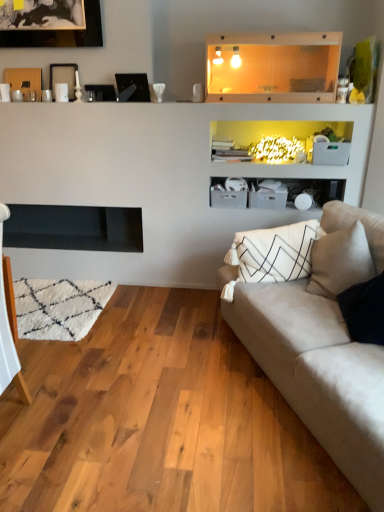
The width and height of the screenshot is (384, 512). Identify the location of transparent glass shelf at upper center. (273, 68).

What do you see at coordinates (74, 228) in the screenshot? I see `black matte fireplace at left` at bounding box center [74, 228].

This screenshot has height=512, width=384. Describe the element at coordinates (102, 92) in the screenshot. I see `matte black picture frame at upper center, which is the 3th picture frame from left to right` at that location.

The width and height of the screenshot is (384, 512). What do you see at coordinates (50, 23) in the screenshot? I see `black matte picture frame at upper left, which is the 1th picture frame in left-to-right order` at bounding box center [50, 23].

What do you see at coordinates (135, 84) in the screenshot? The width and height of the screenshot is (384, 512). I see `black glass picture frame at upper center, marked as the 4th picture frame in a left-to-right arrangement` at bounding box center [135, 84].

Identify the location of transparent glass shelf at upper center. (273, 68).

Locate an element on the screen. the 2nd picture frame above the black glass picture frame at upper center, marked as the 4th picture frame in a left-to-right arrangement (from a real-world perspective) is located at coordinates (50, 23).

Is black matte picture frame at upper left, which is the 1th picture frame in left-to-right order, oriented away from black glass picture frame at upper center, marked as the 4th picture frame in a left-to-right arrangement?

black matte picture frame at upper left, which is the 1th picture frame in left-to-right order, is not turned away from black glass picture frame at upper center, marked as the 4th picture frame in a left-to-right arrangement.

From the image's perspective, is black matte picture frame at upper left, which is the 1th picture frame in left-to-right order, over black glass picture frame at upper center, the 1th picture frame when ordered from right to left?

Yes, from the image's perspective, black matte picture frame at upper left, which is the 1th picture frame in left-to-right order, is on top of black glass picture frame at upper center, the 1th picture frame when ordered from right to left.

From a real-world perspective, which object rests below the other?

black matte fireplace at left, from a real-world perspective.

From a real-world perspective, starting from the black matte fireplace at left, which picture frame is the 4th one vertically above it? Please provide its 2D coordinates.

[(50, 23)]

Is black matte fireplace at left far from black matte picture frame at upper left, the 4th picture frame from the right?

Yes, black matte fireplace at left and black matte picture frame at upper left, the 4th picture frame from the right, are located far from each other.

Is black matte fireplace at left facing towards suede beige couch at right?

No.

From the picture: Which object is closer to the camera, black matte fireplace at left or suede beige couch at right?

suede beige couch at right is in front.

Measure the distance between black matte fireplace at left and suede beige couch at right.

black matte fireplace at left and suede beige couch at right are 1.53 meters apart from each other.

Is black matte fireplace at left with suede beige couch at right?

black matte fireplace at left and suede beige couch at right are clearly separated.

Consider the image. How distant is black glass picture frame at upper center, the 1th picture frame when ordered from right to left, from wooden picture frame at upper left, arranged as the second picture frame when viewed from the left?

The distance of black glass picture frame at upper center, the 1th picture frame when ordered from right to left, from wooden picture frame at upper left, arranged as the second picture frame when viewed from the left, is 17.76 inches.

Consider the image. Could wooden picture frame at upper left, arranged as the second picture frame when viewed from the left, be considered to be inside black glass picture frame at upper center, the 1th picture frame when ordered from right to left?

No, wooden picture frame at upper left, arranged as the second picture frame when viewed from the left, is located outside of black glass picture frame at upper center, the 1th picture frame when ordered from right to left.

Considering the relative positions of black glass picture frame at upper center, the 1th picture frame when ordered from right to left, and wooden picture frame at upper left, the third picture frame from the right, in the image provided, is black glass picture frame at upper center, the 1th picture frame when ordered from right to left, to the left or to the right of wooden picture frame at upper left, the third picture frame from the right,?

From the image, it's evident that black glass picture frame at upper center, the 1th picture frame when ordered from right to left, is to the right of wooden picture frame at upper left, the third picture frame from the right.

From a real-world perspective, count 1st picture frames downward from the wooden picture frame at upper left, arranged as the second picture frame when viewed from the left, and point to it. Please provide its 2D coordinates.

[(135, 84)]

Where is `studio couch lying below the black matte picture frame at upper left, the 4th picture frame from the right (from the image's perspective)`? This screenshot has width=384, height=512. studio couch lying below the black matte picture frame at upper left, the 4th picture frame from the right (from the image's perspective) is located at coordinates (318, 338).

From the image's perspective, is black matte picture frame at upper left, which is the 1th picture frame in left-to-right order, under suede beige couch at right?

Incorrect, from the image's perspective, black matte picture frame at upper left, which is the 1th picture frame in left-to-right order, is higher than suede beige couch at right.

Is black matte picture frame at upper left, which is the 1th picture frame in left-to-right order, positioned with its back to suede beige couch at right?

No, suede beige couch at right is not at the back of black matte picture frame at upper left, which is the 1th picture frame in left-to-right order.

Considering the points (98, 36) and (311, 254), which point is in front, point (98, 36) or point (311, 254)?

Point (311, 254)

From the image's perspective, is suede beige couch at right under matte black picture frame at upper center, which is the 3th picture frame from left to right?

Yes, from the image's perspective, suede beige couch at right is beneath matte black picture frame at upper center, which is the 3th picture frame from left to right.

From the picture: From a real-world perspective, is suede beige couch at right physically above matte black picture frame at upper center, which is the 3th picture frame from left to right?

No, from a real-world perspective, suede beige couch at right is not above matte black picture frame at upper center, which is the 3th picture frame from left to right.

Is matte black picture frame at upper center, the second picture frame positioned from the right, at the back of suede beige couch at right?

No, suede beige couch at right's orientation is not away from matte black picture frame at upper center, the second picture frame positioned from the right.

In the image, is suede beige couch at right positioned in front of or behind matte black picture frame at upper center, the second picture frame positioned from the right?

Clearly, suede beige couch at right is in front of matte black picture frame at upper center, the second picture frame positioned from the right.

Where is `fireplace located above the suede beige couch at right (from the image's perspective)`? fireplace located above the suede beige couch at right (from the image's perspective) is located at coordinates (74, 228).

Between suede beige couch at right and black matte fireplace at left, which one appears on the left side from the viewer's perspective?

black matte fireplace at left.

Based on the photo, can you confirm if suede beige couch at right is thinner than black matte fireplace at left?

No.

Does suede beige couch at right lie in front of black matte fireplace at left?

Yes, the depth of suede beige couch at right is less than that of black matte fireplace at left.

You are a GUI agent. You are given a task and a screenshot of the screen. Output one action in this format:
    pyautogui.click(x=<x>, y=<y>)
    Task: Click on the 3rd picture frame below when counting from the black matte picture frame at upper left, the 4th picture frame from the right (from the image's perspective)
    The image size is (384, 512).
    Given the screenshot: What is the action you would take?
    pos(135,84)

Where is `picture frame that is the 4th one above the black matte fireplace at left (from a real-world perspective)`? picture frame that is the 4th one above the black matte fireplace at left (from a real-world perspective) is located at coordinates (50, 23).

Considering their positions, is black matte fireplace at left positioned closer to matte black picture frame at upper center, which is the 3th picture frame from left to right, than black matte picture frame at upper left, the 4th picture frame from the right?

Based on the image, black matte picture frame at upper left, the 4th picture frame from the right, appears to be nearer to matte black picture frame at upper center, which is the 3th picture frame from left to right.

Based on their spatial positions, is wooden picture frame at upper left, the third picture frame from the right, or matte black picture frame at upper center, the second picture frame positioned from the right, further from black matte picture frame at upper left, which is the 1th picture frame in left-to-right order?

matte black picture frame at upper center, the second picture frame positioned from the right, lies further to black matte picture frame at upper left, which is the 1th picture frame in left-to-right order, than the other object.

Based on their spatial positions, is black glass picture frame at upper center, marked as the 4th picture frame in a left-to-right arrangement, or transparent glass shelf at upper center closer to matte black picture frame at upper center, which is the 3th picture frame from left to right?

The object closer to matte black picture frame at upper center, which is the 3th picture frame from left to right, is black glass picture frame at upper center, marked as the 4th picture frame in a left-to-right arrangement.

Estimate the real-world distances between objects in this image. Which object is further from black glass picture frame at upper center, the 1th picture frame when ordered from right to left, black matte fireplace at left or matte black picture frame at upper center, the second picture frame positioned from the right?

black matte fireplace at left is further to black glass picture frame at upper center, the 1th picture frame when ordered from right to left.

Estimate the real-world distances between objects in this image. Which object is further from matte black picture frame at upper center, the second picture frame positioned from the right, black matte picture frame at upper left, the 4th picture frame from the right, or black glass picture frame at upper center, marked as the 4th picture frame in a left-to-right arrangement?

Among the two, black matte picture frame at upper left, the 4th picture frame from the right, is located further to matte black picture frame at upper center, the second picture frame positioned from the right.

Estimate the real-world distances between objects in this image. Which object is closer to black glass picture frame at upper center, the 1th picture frame when ordered from right to left, suede beige couch at right or black matte fireplace at left?

Based on the image, black matte fireplace at left appears to be nearer to black glass picture frame at upper center, the 1th picture frame when ordered from right to left.

Considering their positions, is black glass picture frame at upper center, the 1th picture frame when ordered from right to left, positioned further to suede beige couch at right than black matte fireplace at left?

black glass picture frame at upper center, the 1th picture frame when ordered from right to left, is positioned further to the anchor suede beige couch at right.

In the scene shown: From the image, which object appears to be farther from black glass picture frame at upper center, the 1th picture frame when ordered from right to left, transparent glass shelf at upper center or suede beige couch at right?

suede beige couch at right lies further to black glass picture frame at upper center, the 1th picture frame when ordered from right to left, than the other object.

Where is `shelf positioned between suede beige couch at right and matte black picture frame at upper center, which is the 3th picture frame from left to right, from near to far`? shelf positioned between suede beige couch at right and matte black picture frame at upper center, which is the 3th picture frame from left to right, from near to far is located at coordinates click(x=273, y=68).

Locate an element on the screen. This screenshot has height=512, width=384. shelf between suede beige couch at right and black glass picture frame at upper center, marked as the 4th picture frame in a left-to-right arrangement, in the front-back direction is located at coordinates (273, 68).

Where is `picture frame between wooden picture frame at upper left, the third picture frame from the right, and black glass picture frame at upper center, the 1th picture frame when ordered from right to left, from left to right`? picture frame between wooden picture frame at upper left, the third picture frame from the right, and black glass picture frame at upper center, the 1th picture frame when ordered from right to left, from left to right is located at coordinates (102, 92).

Identify the location of picture frame between matte black picture frame at upper center, the second picture frame positioned from the right, and black matte fireplace at left from top to bottom. This screenshot has width=384, height=512. (135, 84).